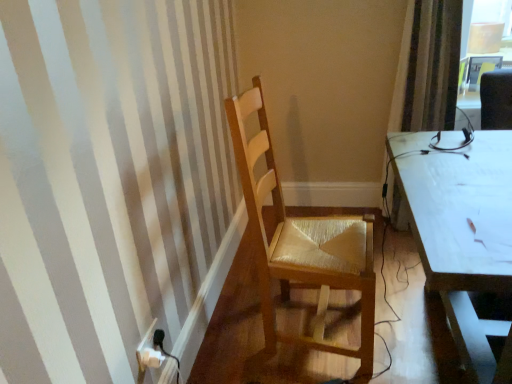
Question: From the image's perspective, is striped fabric curtain at right under white plastic power plugs and sockets at lower left?

Choices:
 (A) no
 (B) yes

Answer: (A)

Question: Considering the relative sizes of striped fabric curtain at right and white plastic power plugs and sockets at lower left in the image provided, is striped fabric curtain at right smaller than white plastic power plugs and sockets at lower left?

Choices:
 (A) yes
 (B) no

Answer: (B)

Question: Is striped fabric curtain at right at the left side of white plastic power plugs and sockets at lower left?

Choices:
 (A) yes
 (B) no

Answer: (B)

Question: From the image's perspective, is striped fabric curtain at right located above white plastic power plugs and sockets at lower left?

Choices:
 (A) no
 (B) yes

Answer: (B)

Question: Considering the relative sizes of striped fabric curtain at right and white plastic power plugs and sockets at lower left in the image provided, is striped fabric curtain at right shorter than white plastic power plugs and sockets at lower left?

Choices:
 (A) yes
 (B) no

Answer: (B)

Question: From the image's perspective, is light brown wood chair at center located above or below striped fabric curtain at right?

Choices:
 (A) below
 (B) above

Answer: (A)

Question: From a real-world perspective, is light brown wood chair at center physically located above or below striped fabric curtain at right?

Choices:
 (A) below
 (B) above

Answer: (A)

Question: In the image, is light brown wood chair at center on the left side or the right side of striped fabric curtain at right?

Choices:
 (A) right
 (B) left

Answer: (B)

Question: Considering the positions of point (265, 183) and point (414, 69), is point (265, 183) closer or farther from the camera than point (414, 69)?

Choices:
 (A) farther
 (B) closer

Answer: (B)

Question: Is striped fabric curtain at right inside the boundaries of white plastic power plugs and sockets at lower left, or outside?

Choices:
 (A) inside
 (B) outside

Answer: (B)

Question: Considering the positions of point (444, 127) and point (138, 369), is point (444, 127) closer or farther from the camera than point (138, 369)?

Choices:
 (A) closer
 (B) farther

Answer: (B)

Question: From their relative heights in the image, would you say striped fabric curtain at right is taller or shorter than white plastic power plugs and sockets at lower left?

Choices:
 (A) short
 (B) tall

Answer: (B)

Question: Looking at their shapes, would you say striped fabric curtain at right is wider or thinner than white plastic power plugs and sockets at lower left?

Choices:
 (A) wide
 (B) thin

Answer: (A)

Question: Considering the relative positions of light brown wood chair at center and white plastic power plugs and sockets at lower left in the image provided, is light brown wood chair at center to the left or to the right of white plastic power plugs and sockets at lower left?

Choices:
 (A) left
 (B) right

Answer: (B)

Question: Choose the correct answer: Is light brown wood chair at center inside white plastic power plugs and sockets at lower left or outside it?

Choices:
 (A) outside
 (B) inside

Answer: (A)